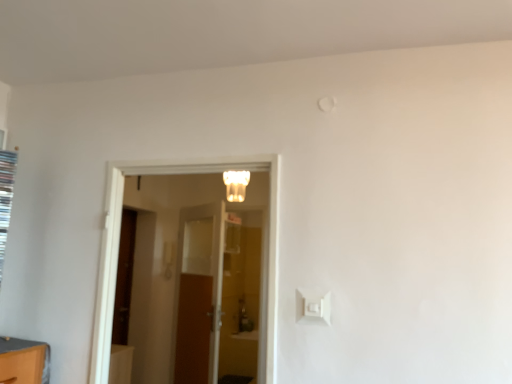
Question: Considering their positions, is wooden door at center, acting as the first door starting from the back, located in front of or behind white glossy door at center, placed as the 1th door when sorted from front to back?

Choices:
 (A) behind
 (B) front

Answer: (A)

Question: Considering the relative positions of wooden door at center, the second door positioned from the front, and white glossy door at center, arranged as the 2th door when viewed from the back, in the image provided, is wooden door at center, the second door positioned from the front, to the left or to the right of white glossy door at center, arranged as the 2th door when viewed from the back,?

Choices:
 (A) right
 (B) left

Answer: (B)

Question: Estimate the real-world distances between objects in this image. Which object is closer to the wooden door at center, the second door positioned from the front?

Choices:
 (A) white plastic light switch at lower right
 (B) white frosted glass light fixture at center
 (C) white glossy door at center, placed as the 1th door when sorted from front to back

Answer: (B)

Question: Which object is positioned farthest from the white frosted glass light fixture at center?

Choices:
 (A) white glossy door at center, placed as the 1th door when sorted from front to back
 (B) wooden door at center, the second door positioned from the front
 (C) white plastic light switch at lower right

Answer: (C)